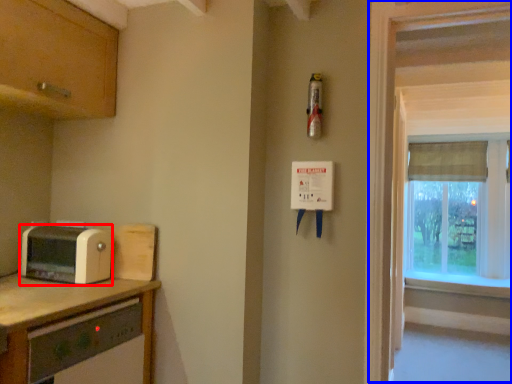
Question: Among these objects, which one is nearest to the camera, toaster (highlighted by a red box) or window frame (highlighted by a blue box)?

Choices:
 (A) toaster
 (B) window frame

Answer: (B)